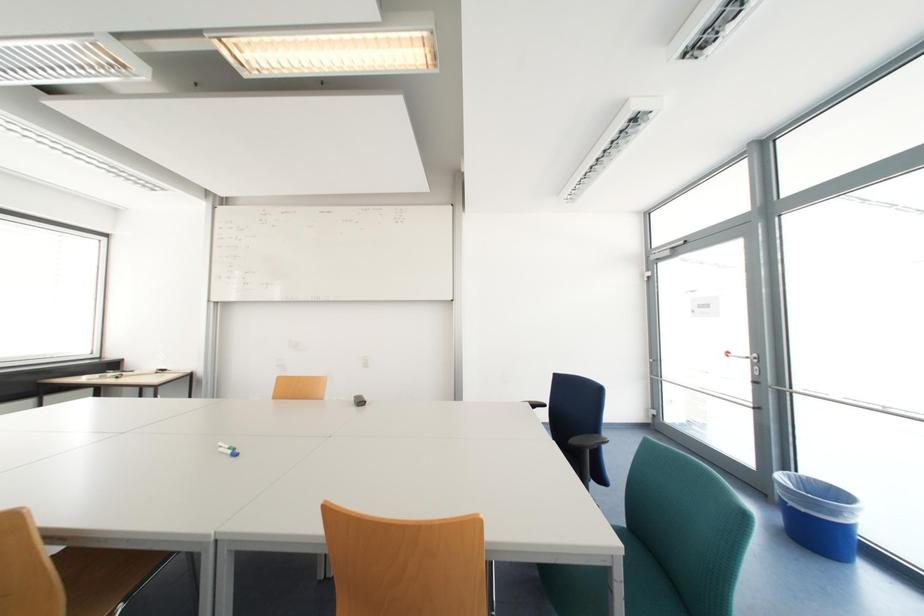
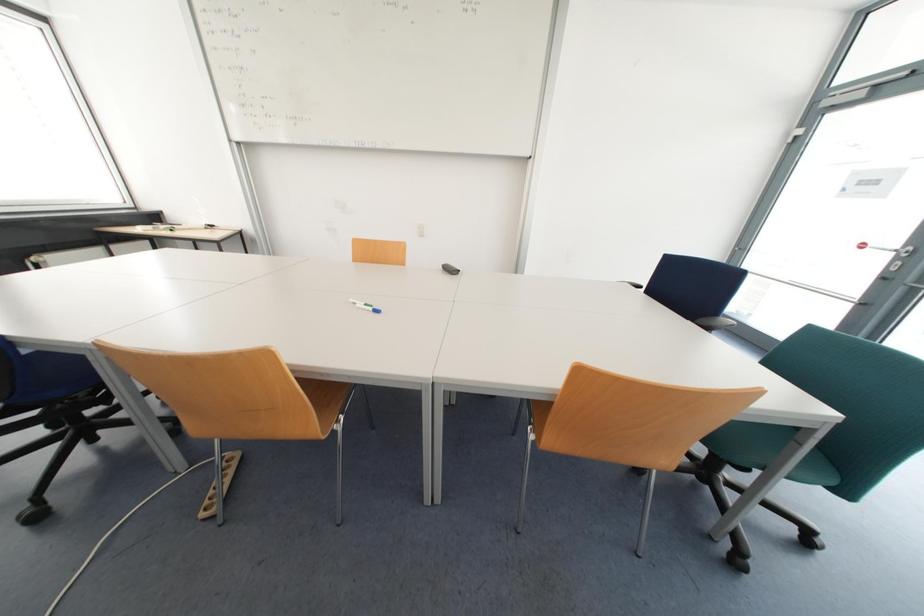
Question: What movement of the cameraman would produce the second image?

Choices:
 (A) Left
 (B) Right
 (C) Forward
 (D) Backward

Answer: (A)